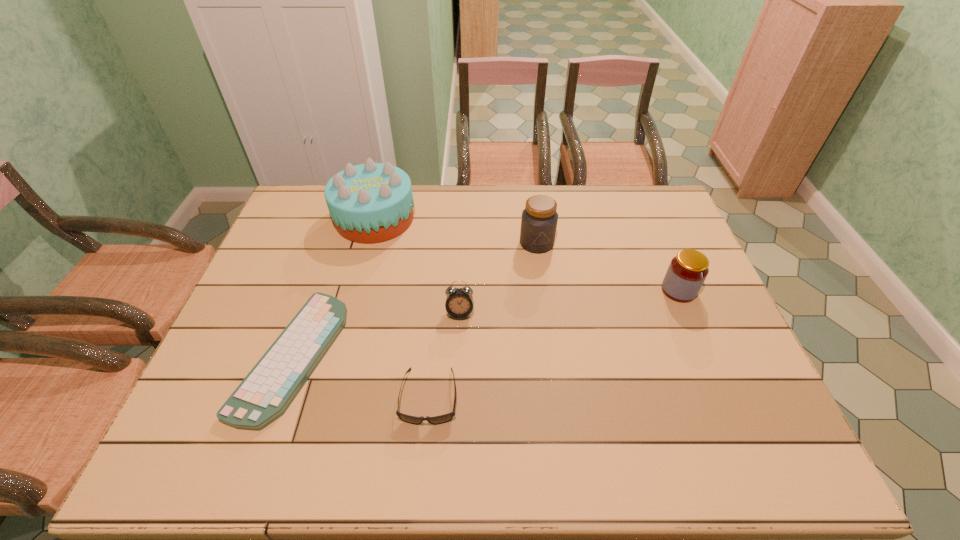
The height and width of the screenshot is (540, 960). Find the location of `cake`. cake is located at coordinates (369, 203).

Where is `the farther jar`? Image resolution: width=960 pixels, height=540 pixels. the farther jar is located at coordinates (539, 219).

Locate an element on the screen. The height and width of the screenshot is (540, 960). the taller jar is located at coordinates (539, 219).

Identify the location of the fourth shortest object. (687, 271).

Where is `the shorter jar`? This screenshot has height=540, width=960. the shorter jar is located at coordinates (687, 271).

Find the location of a particular element. Image resolution: width=960 pixels, height=540 pixels. alarm clock is located at coordinates tap(459, 302).

Identify the location of sunglasses. (441, 419).

Locate an element on the screen. The height and width of the screenshot is (540, 960). the shortest object is located at coordinates (265, 394).

Locate an element on the screen. vacant region located 0.060m on the left of the cake is located at coordinates (317, 219).

This screenshot has height=540, width=960. I want to click on free space located on the surface of the farther jar near the warning symbol, so coord(551,349).